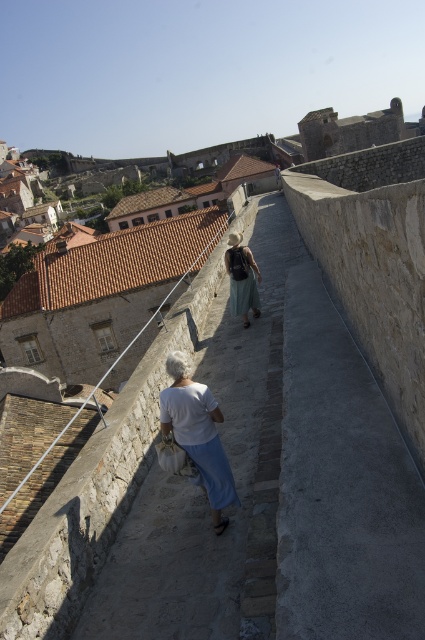
You are a tour guide leading a group through the historic fortification walkway. You notice two visitors wearing a white cotton shirt at center and a light green fabric dress at center. Which visitor is closer to the group as you look ahead?

The white cotton shirt at center is closer to the group because it is in front of the light green fabric dress at center.

You are a tour guide leading a group along the narrow stone walkway between the high walls. You notice two points marked on the path. The first is at point (167, 371) and the second at point (235, 268). Which point should your group step on first to follow the correct path forward?

The group should step on point (167, 371) first because it is in front of point (235, 268), indicating the correct forward direction along the walkway.

You are standing at the camera position and want to reach the point at coordinates (164, 392) in the image. Is this point within a 5 meter radius from your current position?

The point at coordinates (164, 392) is 7.95 meters away from the camera, so it is outside the 5 meter radius.